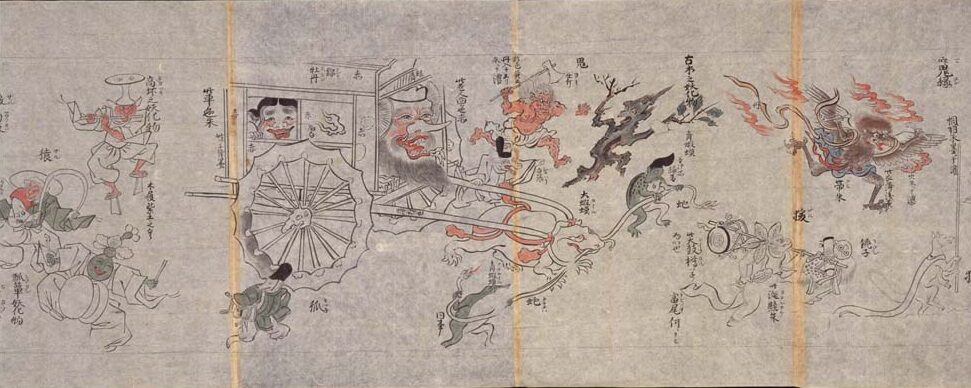
Where is `peg`? peg is located at coordinates (288, 227).